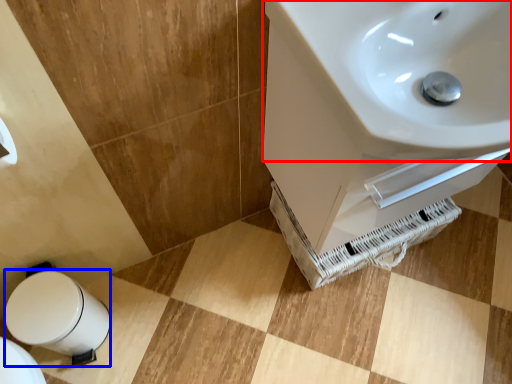
Question: Which object appears farthest to the camera in this image, sink (highlighted by a red box) or bidet (highlighted by a blue box)?

Choices:
 (A) sink
 (B) bidet

Answer: (B)